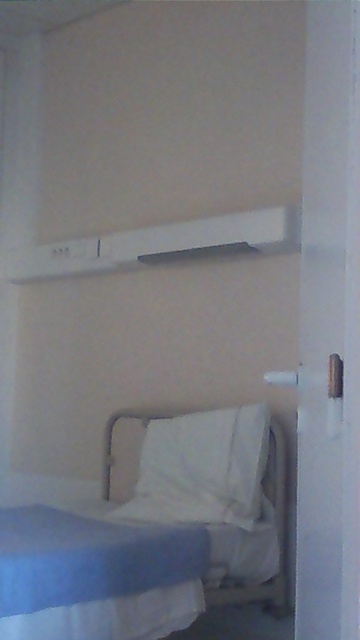
Is point (2, 596) positioned behind point (39, 573)?

No, (2, 596) is closer to viewer.

Does blue fabric bed at lower left come in front of blue soft fabric blanket at lower left?

No, blue fabric bed at lower left is further to the viewer.

Is point (169, 524) closer to viewer compared to point (23, 534)?

No, it is behind (23, 534).

Find the location of a particular element. This screenshot has height=640, width=360. blue fabric bed at lower left is located at coordinates (153, 538).

Does blue fabric bed at lower left appear on the left side of white soft pillow at lower center?

Correct, you'll find blue fabric bed at lower left to the left of white soft pillow at lower center.

Does blue fabric bed at lower left appear over white soft pillow at lower center?

No, blue fabric bed at lower left is not above white soft pillow at lower center.

Is point (236, 467) farther from camera compared to point (205, 420)?

No, (236, 467) is closer to viewer.

This screenshot has width=360, height=640. What are the coordinates of `blue fabric bed at lower left` in the screenshot? It's located at (153, 538).

In the scene shown: Can you confirm if blue soft fabric blanket at lower left is positioned to the right of white soft pillow at lower center?

In fact, blue soft fabric blanket at lower left is to the left of white soft pillow at lower center.

Can you confirm if blue soft fabric blanket at lower left is shorter than white soft pillow at lower center?

Yes.

This screenshot has width=360, height=640. I want to click on blue soft fabric blanket at lower left, so click(x=96, y=577).